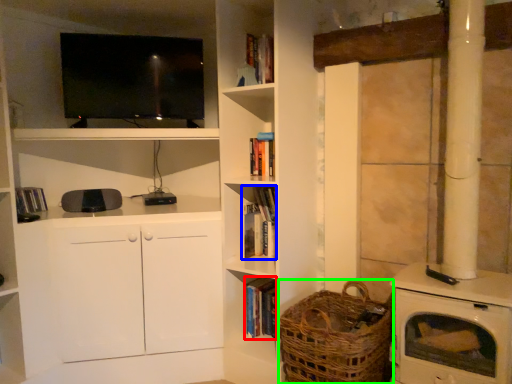
Question: Estimate the real-world distances between objects in this image. Which object is closer to book (highlighted by a red box), book (highlighted by a blue box) or basket (highlighted by a green box)?

Choices:
 (A) book
 (B) basket

Answer: (A)